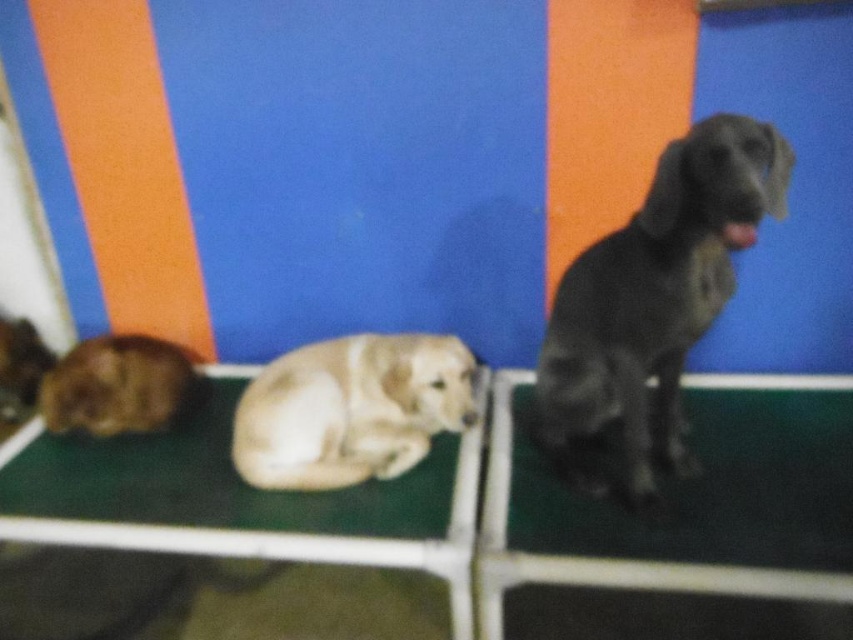
You are a judge at a dog show and need to position the light brown fur at center and the brown fur dog at left correctly according to their positions. Which dog is positioned to the right of the other?

The light brown fur at center is to the right of the brown fur dog at left.

You are a photographer standing at the origin point of the platform. You need to capture a photo of the brown fur dog at left. According to the coordinates provided, where should you aim your camera to ensure the dog is centered in the frame?

The brown fur dog at left is located at coordinates point [115,385], so you should aim your camera at that specific coordinate point to center the dog in the frame.

You are a photographer setting up for a dog show. You have a camera with a focus range of 10 inches. You need to capture both the brown fur dog at left and the shiny brown fur at lower left in the same shot. Can your camera focus on both subjects simultaneously?

The brown fur dog at left is 10.37 inches from the shiny brown fur at lower left. Since your camera has a focus range of 10 inches, it cannot focus on both subjects simultaneously because the distance between them exceeds the focus range.